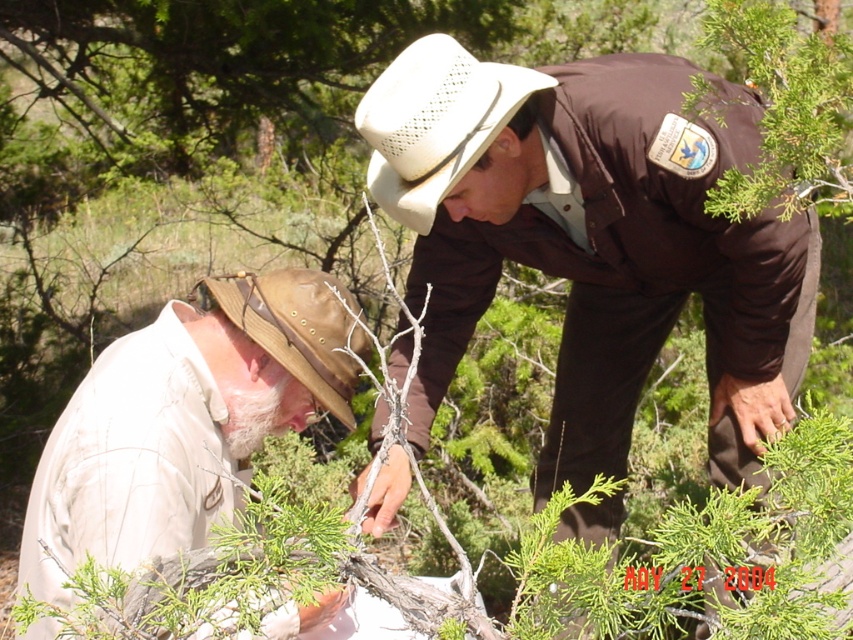
You are standing in a forest and see two people examining a tree. The people are wearing a brown uniform at center and a white woven hat at center. Which person is standing to the right of the other?

The brown uniform at center is positioned on the right side of white woven hat at center, so the person in the brown uniform at center is to the right of the person with the white woven hat at center.